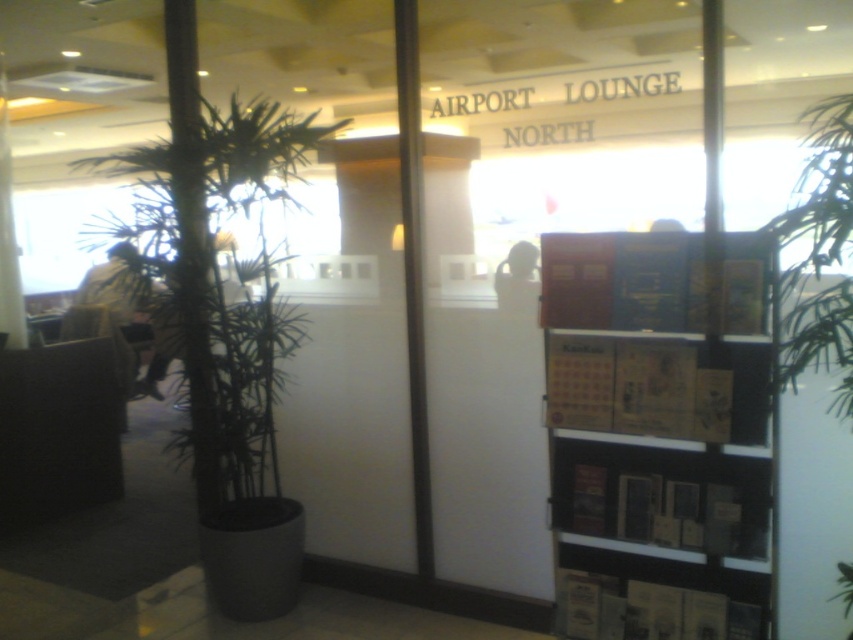
You are a traveler looking for a place to sit and read. You see the wooden bookshelf at right and the green bamboo at left. Which object is closer to the entrance of the Airport Lounge North?

The wooden bookshelf at right is closer to the entrance of the Airport Lounge North because it is positioned to the right of the green bamboo at left, which suggests it is nearer to the entrance area.

You are a traveler trying to find a place to sit in the airport lounge. You see the green leafy plant at center and the green bamboo at left. Which one is closer to the entrance?

The green leafy plant at center is closer to the entrance than the green bamboo at left because it has a smaller size compared to the green bamboo at left.